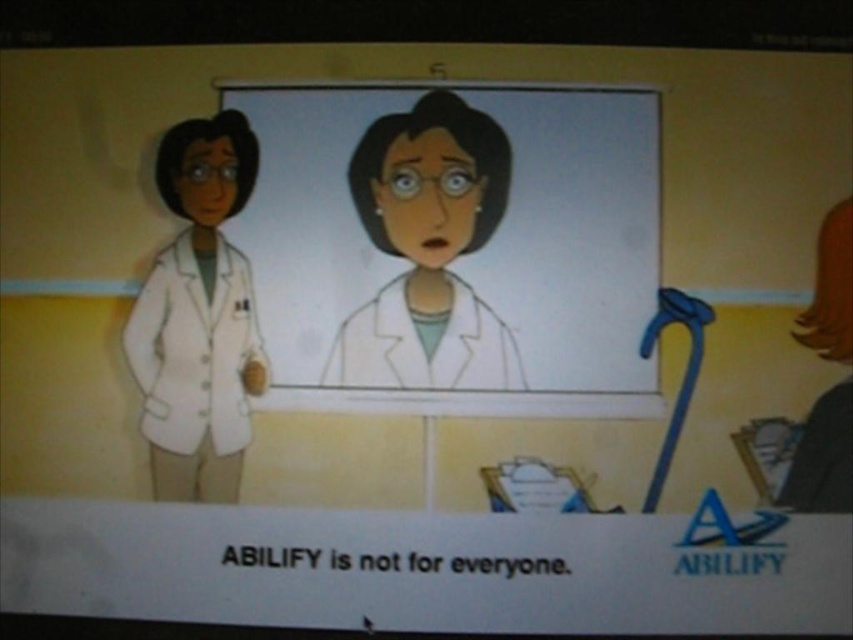
Is white lab coat at center shorter than white matte lab coat at left?

No.

The height and width of the screenshot is (640, 853). What do you see at coordinates (453, 237) in the screenshot? I see `white lab coat at center` at bounding box center [453, 237].

Find the location of `white lab coat at center`. white lab coat at center is located at coordinates (453, 237).

Can you confirm if white lab coat at center is positioned to the right of matte white coat at center?

Indeed, white lab coat at center is positioned on the right side of matte white coat at center.

Can you confirm if white lab coat at center is smaller than matte white coat at center?

Incorrect, white lab coat at center is not smaller in size than matte white coat at center.

Is point (408, 324) behind point (445, 292)?

No, it is not.

Locate an element on the screen. white lab coat at center is located at coordinates (453, 237).

This screenshot has width=853, height=640. What do you see at coordinates (428, 252) in the screenshot? I see `matte white coat at center` at bounding box center [428, 252].

Between matte white coat at center and white matte lab coat at left, which one has more height?

With more height is matte white coat at center.

Does point (448, 147) come behind point (209, 291)?

Yes, point (448, 147) is behind point (209, 291).

You are a GUI agent. You are given a task and a screenshot of the screen. Output one action in this format:
    pyautogui.click(x=<x>, y=<y>)
    Task: Click on the matte white coat at center
    The height and width of the screenshot is (640, 853).
    Given the screenshot: What is the action you would take?
    coord(428,252)